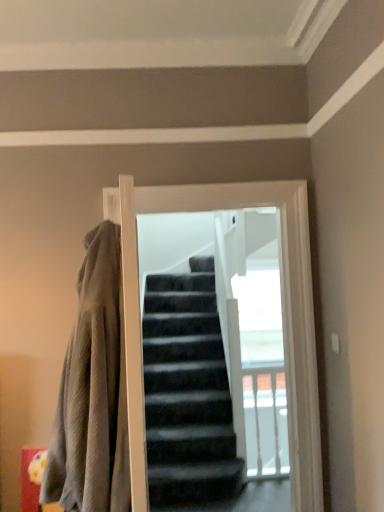
In order to face textured gray blanket at left, should I rotate leftwards or rightwards?

You should rotate left by 15.163 degrees.

Describe the element at coordinates (93, 391) in the screenshot. This screenshot has height=512, width=384. I see `textured gray blanket at left` at that location.

Image resolution: width=384 pixels, height=512 pixels. What are the coordinates of `textured gray blanket at left` in the screenshot? It's located at (93, 391).

Describe the element at coordinates (282, 313) in the screenshot. I see `black matte screen door at center` at that location.

The width and height of the screenshot is (384, 512). In order to click on black matte screen door at center in this screenshot , I will do [282, 313].

The image size is (384, 512). I want to click on textured gray blanket at left, so click(93, 391).

Does textured gray blanket at left appear on the right side of black matte screen door at center?

Incorrect, textured gray blanket at left is not on the right side of black matte screen door at center.

Is textured gray blanket at left in front of black matte screen door at center?

Yes, textured gray blanket at left is in front of black matte screen door at center.

Does point (99, 350) come behind point (119, 201)?

That is False.

From the image's perspective, relative to black matte screen door at center, is textured gray blanket at left above or below?

Based on their image positions, textured gray blanket at left is located beneath black matte screen door at center.

From a real-world perspective, between textured gray blanket at left and black matte screen door at center, who is vertically lower?

In real-world perspective, textured gray blanket at left is lower.

Based on the photo, is textured gray blanket at left wider or thinner than black matte screen door at center?

In the image, textured gray blanket at left appears to be wider than black matte screen door at center.

Which of these two, textured gray blanket at left or black matte screen door at center, stands shorter?

With less height is textured gray blanket at left.

Considering the sizes of objects textured gray blanket at left and black matte screen door at center in the image provided, who is bigger, textured gray blanket at left or black matte screen door at center?

With larger size is textured gray blanket at left.

Which is correct: textured gray blanket at left is inside black matte screen door at center, or outside of it?

textured gray blanket at left is outside black matte screen door at center.

Is there a large distance between textured gray blanket at left and black matte screen door at center?

Actually, textured gray blanket at left and black matte screen door at center are a little close together.

Is textured gray blanket at left turned away from black matte screen door at center?

Absolutely, textured gray blanket at left is directed away from black matte screen door at center.

I want to click on screen door above the textured gray blanket at left (from the image's perspective), so click(x=282, y=313).

Which is more to the right, black matte screen door at center or textured gray blanket at left?

Positioned to the right is black matte screen door at center.

Which object is closer to the camera taking this photo, black matte screen door at center or textured gray blanket at left?

textured gray blanket at left is in front.

Is point (301, 183) closer to camera compared to point (110, 331)?

No, (301, 183) is further to viewer.

From the image's perspective, is black matte screen door at center on textured gray blanket at left?

Indeed, from the image's perspective, black matte screen door at center is shown above textured gray blanket at left.

From a real-world perspective, does black matte screen door at center sit lower than textured gray blanket at left?

No, from a real-world perspective, black matte screen door at center is not beneath textured gray blanket at left.

Is black matte screen door at center wider than textured gray blanket at left?

No.

Is black matte screen door at center shorter than textured gray blanket at left?

In fact, black matte screen door at center may be taller than textured gray blanket at left.

Between black matte screen door at center and textured gray blanket at left, which one has smaller size?

black matte screen door at center.

Is black matte screen door at center positioned beyond the bounds of textured gray blanket at left?

That's correct, black matte screen door at center is outside of textured gray blanket at left.

Is black matte screen door at center in contact with textured gray blanket at left?

black matte screen door at center and textured gray blanket at left are clearly separated.

Could you tell me if black matte screen door at center is facing textured gray blanket at left?

No, black matte screen door at center is not turned towards textured gray blanket at left.

How many degrees apart are the facing directions of black matte screen door at center and textured gray blanket at left?

black matte screen door at center and textured gray blanket at left are facing 85.1 degrees away from each other.

The width and height of the screenshot is (384, 512). Find the location of `blanket lying below the black matte screen door at center (from the image's perspective)`. blanket lying below the black matte screen door at center (from the image's perspective) is located at coordinates (93, 391).

Image resolution: width=384 pixels, height=512 pixels. In the image, there is a textured gray blanket at left. Find the location of `screen door above it (from the image's perspective)`. screen door above it (from the image's perspective) is located at coordinates (282, 313).

At what (x,y) coordinates should I click in order to perform the action: click on blanket on the left of black matte screen door at center. Please return your answer as a coordinate pair (x, y). This screenshot has width=384, height=512. Looking at the image, I should click on click(93, 391).